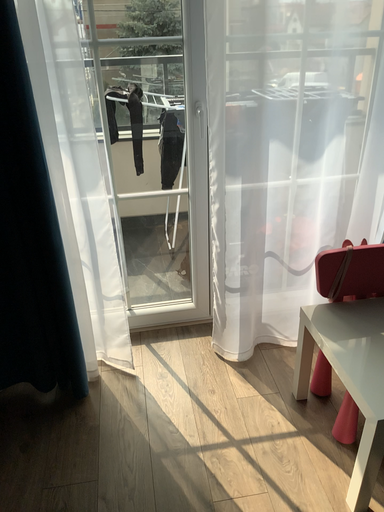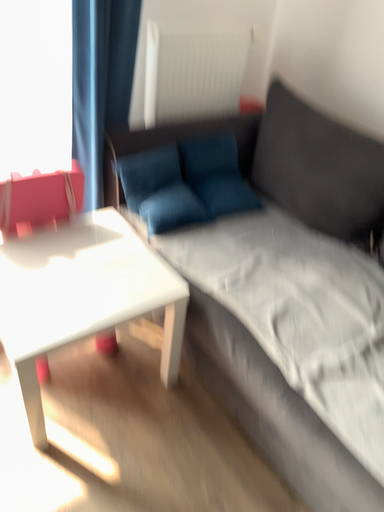
Question: How did the camera likely rotate when shooting the video?

Choices:
 (A) rotated left
 (B) rotated right

Answer: (B)